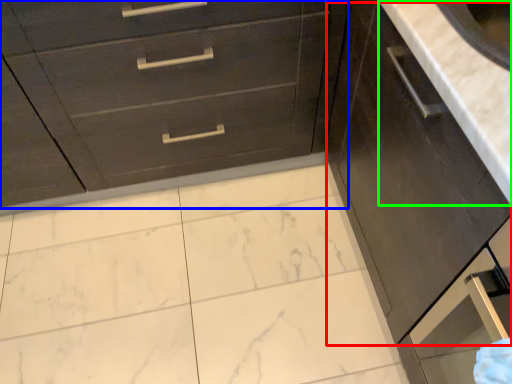
Question: Considering the real-world distances, which object is closest to cabinetry (highlighted by a red box)? chest of drawers (highlighted by a blue box) or counter top (highlighted by a green box).

Choices:
 (A) chest of drawers
 (B) counter top

Answer: (B)